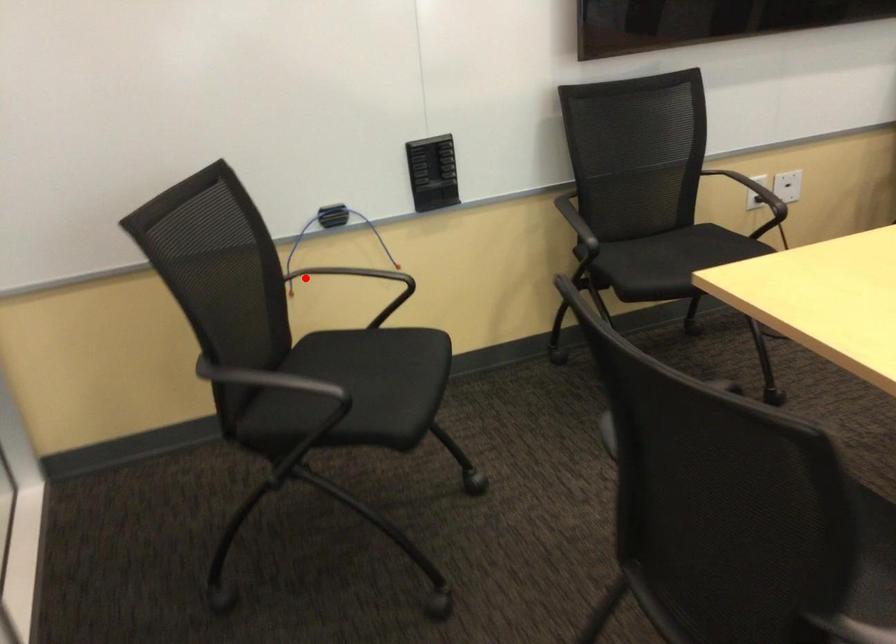
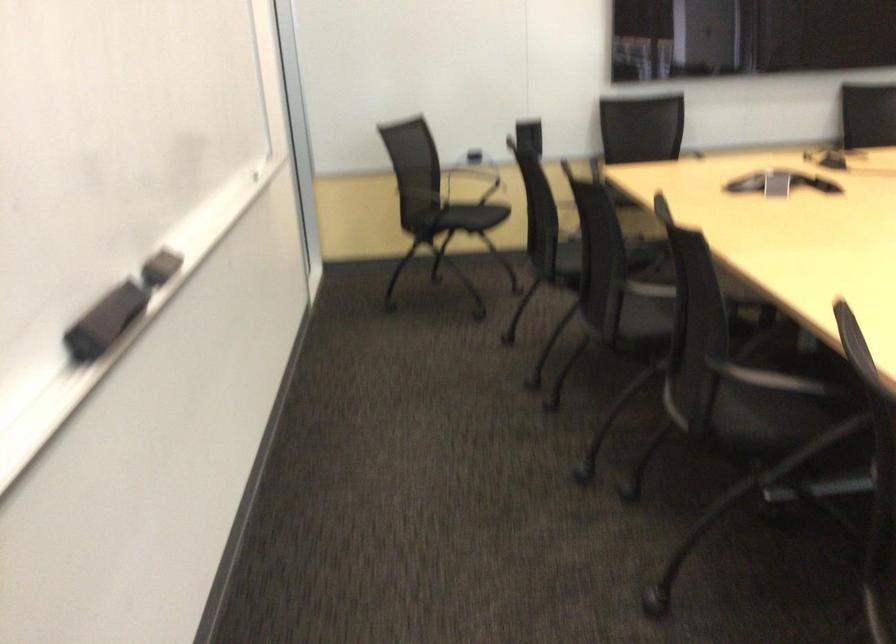
Question: I am providing you with two images of the same scene from different viewpoints. A red point is shown in image1. For the corresponding object point in image2, is it positioned nearer or farther from the camera?

Choices:
 (A) Nearer
 (B) Farther

Answer: (B)